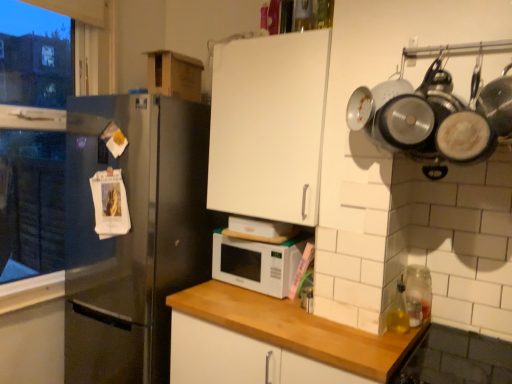
Identify the location of translucent yellow glass at right. This screenshot has height=384, width=512. (398, 311).

This screenshot has height=384, width=512. What do you see at coordinates (133, 234) in the screenshot?
I see `stainless steel refrigerator at left` at bounding box center [133, 234].

This screenshot has height=384, width=512. What do you see at coordinates (257, 263) in the screenshot?
I see `white matte microwave at center` at bounding box center [257, 263].

In order to face clear glass jar at right, should I rotate leftwards or rightwards?

To align with it, rotate right about 20.749°.

What do you see at coordinates (240, 358) in the screenshot? The width and height of the screenshot is (512, 384). I see `white wood countertop at center, which appears as the 2th cabinetry when viewed from the top` at bounding box center [240, 358].

The width and height of the screenshot is (512, 384). In order to click on translucent yellow glass at right in this screenshot , I will do `click(398, 311)`.

I want to click on microwave oven that appears behind the translucent yellow glass at right, so click(x=257, y=263).

From the image's perspective, which object appears higher, white matte microwave at center or translucent yellow glass at right?

white matte microwave at center.

Which object is positioned more to the right, white matte microwave at center or translucent yellow glass at right?

From the viewer's perspective, translucent yellow glass at right appears more on the right side.

Can you confirm if white wood countertop at center, which appears as the first cabinetry when ordered from the bottom, is wider than white matte microwave at center?

Yes, white wood countertop at center, which appears as the first cabinetry when ordered from the bottom, is wider than white matte microwave at center.

From the image's perspective, which one is positioned lower, white wood countertop at center, which appears as the first cabinetry when ordered from the bottom, or white matte microwave at center?

From the image's view, white wood countertop at center, which appears as the first cabinetry when ordered from the bottom, is below.

Can you confirm if white wood countertop at center, which appears as the 2th cabinetry when viewed from the top, is smaller than white matte microwave at center?

Incorrect, white wood countertop at center, which appears as the 2th cabinetry when viewed from the top, is not smaller in size than white matte microwave at center.

In the scene shown: Is white wood countertop at center, which appears as the first cabinetry when ordered from the bottom, facing away from white matte microwave at center?

No, white matte microwave at center is not at the back of white wood countertop at center, which appears as the first cabinetry when ordered from the bottom.

Does white matte cabinet at upper center, placed as the 1th cabinetry when sorted from top to bottom, appear on the left side of clear glass jar at right?

Correct, you'll find white matte cabinet at upper center, placed as the 1th cabinetry when sorted from top to bottom, to the left of clear glass jar at right.

Considering the sizes of objects white matte cabinet at upper center, the second cabinetry from the bottom, and clear glass jar at right in the image provided, who is shorter, white matte cabinet at upper center, the second cabinetry from the bottom, or clear glass jar at right?

clear glass jar at right.

Which object is wider, white matte cabinet at upper center, placed as the 1th cabinetry when sorted from top to bottom, or clear glass jar at right?

Wider between the two is white matte cabinet at upper center, placed as the 1th cabinetry when sorted from top to bottom.

Considering the relative sizes of white matte cabinet at upper center, the second cabinetry from the bottom, and clear glass jar at right in the image provided, is white matte cabinet at upper center, the second cabinetry from the bottom, bigger than clear glass jar at right?

Yes, white matte cabinet at upper center, the second cabinetry from the bottom, is bigger than clear glass jar at right.

Between stainless steel refrigerator at left and white wood countertop at center, which appears as the first cabinetry when ordered from the bottom, which one has more height?

Standing taller between the two is stainless steel refrigerator at left.

Which is more to the right, stainless steel refrigerator at left or white wood countertop at center, which appears as the 2th cabinetry when viewed from the top?

Positioned to the right is white wood countertop at center, which appears as the 2th cabinetry when viewed from the top.

Considering the sizes of objects stainless steel refrigerator at left and white wood countertop at center, which appears as the first cabinetry when ordered from the bottom, in the image provided, who is wider, stainless steel refrigerator at left or white wood countertop at center, which appears as the first cabinetry when ordered from the bottom,?

white wood countertop at center, which appears as the first cabinetry when ordered from the bottom.

What's the angular difference between translucent yellow glass at right and white wood countertop at center, which appears as the first cabinetry when ordered from the bottom,'s facing directions?

The angular difference between translucent yellow glass at right and white wood countertop at center, which appears as the first cabinetry when ordered from the bottom, is 89.4 degrees.

I want to click on bottle above the white wood countertop at center, which appears as the 2th cabinetry when viewed from the top (from a real-world perspective), so click(x=398, y=311).

Is translucent yellow glass at right facing away from white wood countertop at center, which appears as the 2th cabinetry when viewed from the top?

No.

Who is shorter, translucent yellow glass at right or white wood countertop at center, which appears as the first cabinetry when ordered from the bottom?

Standing shorter between the two is translucent yellow glass at right.

Which is correct: stainless steel refrigerator at left is inside white matte cabinet at upper center, placed as the 1th cabinetry when sorted from top to bottom, or outside of it?

stainless steel refrigerator at left is outside white matte cabinet at upper center, placed as the 1th cabinetry when sorted from top to bottom.

This screenshot has width=512, height=384. I want to click on refrigerator to the left of white matte cabinet at upper center, placed as the 1th cabinetry when sorted from top to bottom, so click(x=133, y=234).

Are stainless steel refrigerator at left and white matte cabinet at upper center, the second cabinetry from the bottom, far apart?

stainless steel refrigerator at left is actually quite close to white matte cabinet at upper center, the second cabinetry from the bottom.

Between stainless steel refrigerator at left and white matte cabinet at upper center, placed as the 1th cabinetry when sorted from top to bottom, which one appears on the right side from the viewer's perspective?

Positioned to the right is white matte cabinet at upper center, placed as the 1th cabinetry when sorted from top to bottom.

Could you tell me if translucent yellow glass at right is facing stainless steel refrigerator at left?

No, translucent yellow glass at right does not turn towards stainless steel refrigerator at left.

Locate an element on the screen. Image resolution: width=512 pixels, height=384 pixels. refrigerator behind the translucent yellow glass at right is located at coordinates (133, 234).

Between point (391, 312) and point (90, 101), which one is positioned behind?

The point (90, 101) is more distant.

Is translucent yellow glass at right directly adjacent to stainless steel refrigerator at left?

No, translucent yellow glass at right is not with stainless steel refrigerator at left.

The image size is (512, 384). I want to click on microwave oven behind the translucent yellow glass at right, so click(x=257, y=263).

The height and width of the screenshot is (384, 512). I want to click on the 2nd cabinetry in front of the white matte microwave at center, so click(x=240, y=358).

Estimate the real-world distances between objects in this image. Which object is further from white matte cabinet at upper center, the second cabinetry from the bottom, clear glass jar at right or stainless steel refrigerator at left?

clear glass jar at right lies further to white matte cabinet at upper center, the second cabinetry from the bottom, than the other object.

When comparing their distances from white matte cabinet at upper center, placed as the 1th cabinetry when sorted from top to bottom, does stainless steel refrigerator at left or translucent yellow glass at right seem closer?

Among the two, stainless steel refrigerator at left is located nearer to white matte cabinet at upper center, placed as the 1th cabinetry when sorted from top to bottom.

Looking at the image, which one is located closer to translucent yellow glass at right, clear glass jar at right or white matte cabinet at upper center, placed as the 1th cabinetry when sorted from top to bottom?

clear glass jar at right.

Estimate the real-world distances between objects in this image. Which object is further from stainless steel refrigerator at left, translucent yellow glass at right or white wood countertop at center, which appears as the 2th cabinetry when viewed from the top?

translucent yellow glass at right is further to stainless steel refrigerator at left.

From the image, which object appears to be nearer to clear glass jar at right, white matte cabinet at upper center, placed as the 1th cabinetry when sorted from top to bottom, or stainless steel refrigerator at left?

Based on the image, white matte cabinet at upper center, placed as the 1th cabinetry when sorted from top to bottom, appears to be nearer to clear glass jar at right.

Based on their spatial positions, is stainless steel refrigerator at left or clear glass jar at right further from white matte microwave at center?

clear glass jar at right is positioned further to the anchor white matte microwave at center.

Which object lies nearer to the anchor point white wood countertop at center, which appears as the 2th cabinetry when viewed from the top, clear glass jar at right or white matte cabinet at upper center, the second cabinetry from the bottom?

The object closer to white wood countertop at center, which appears as the 2th cabinetry when viewed from the top, is clear glass jar at right.

Estimate the real-world distances between objects in this image. Which object is closer to white matte microwave at center, translucent yellow glass at right or clear glass jar at right?

translucent yellow glass at right is positioned closer to the anchor white matte microwave at center.

The image size is (512, 384). I want to click on microwave oven between stainless steel refrigerator at left and white wood countertop at center, which appears as the 2th cabinetry when viewed from the top, so (257, 263).

Find the location of `microwave oven located between stainless steel refrigerator at left and white matte cabinet at upper center, placed as the 1th cabinetry when sorted from top to bottom, in the left-right direction`. microwave oven located between stainless steel refrigerator at left and white matte cabinet at upper center, placed as the 1th cabinetry when sorted from top to bottom, in the left-right direction is located at coordinates (257, 263).

The height and width of the screenshot is (384, 512). In order to click on appliance between white matte cabinet at upper center, the second cabinetry from the bottom, and translucent yellow glass at right in the up-down direction in this screenshot , I will do `click(418, 293)`.

Find the location of a particular element. microwave oven between white matte cabinet at upper center, placed as the 1th cabinetry when sorted from top to bottom, and translucent yellow glass at right in the up-down direction is located at coordinates (257, 263).